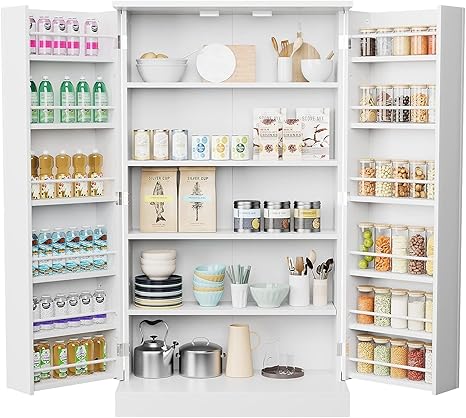
I want to click on bottles on top shelf on left side, so click(92, 46), click(68, 43), click(54, 47), click(41, 39), click(32, 42).